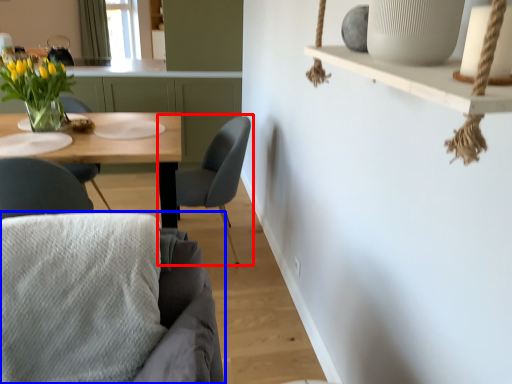
Question: Which of the following is the farthest to the observer, chair (highlighted by a red box) or chair (highlighted by a blue box)?

Choices:
 (A) chair
 (B) chair

Answer: (A)